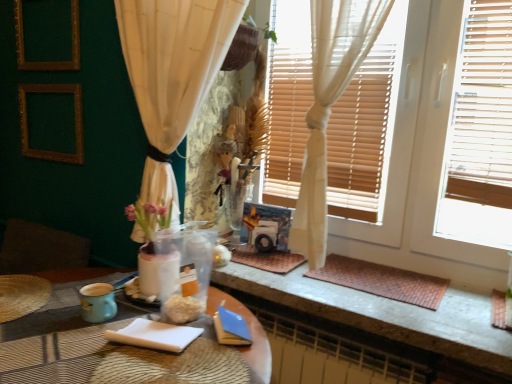
The image size is (512, 384). In order to click on unoccupied area in front of teal ceramic mug at lower left in this screenshot , I will do `click(73, 342)`.